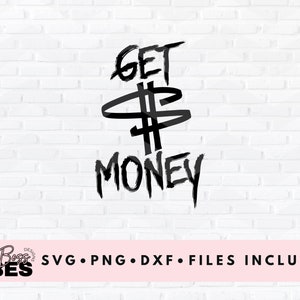
Where is `brick wall`? This screenshot has width=300, height=300. brick wall is located at coordinates tap(251, 127).